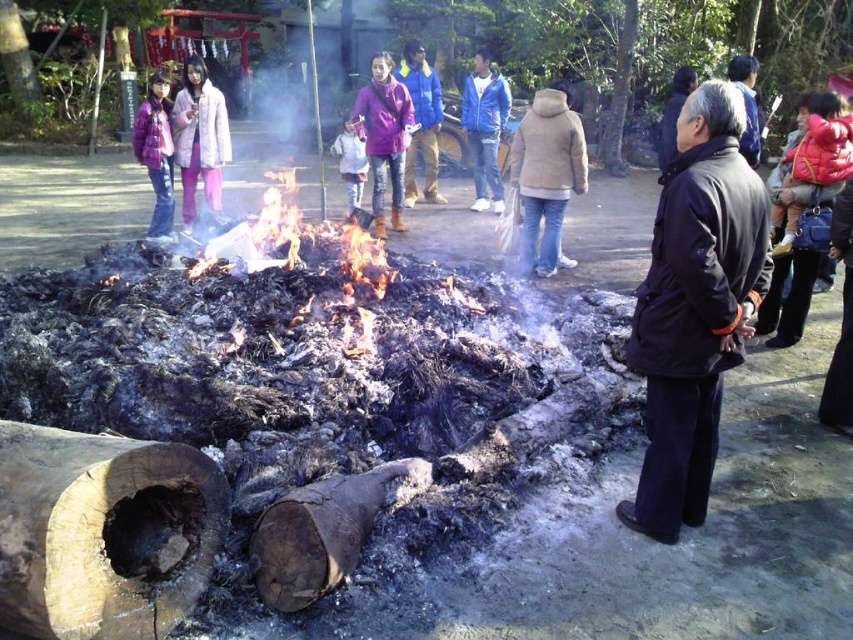
Can you confirm if pink fuzzy coat at center is wider than blue down jacket at center?

No, pink fuzzy coat at center is not wider than blue down jacket at center.

Is point (193, 109) closer to viewer compared to point (424, 163)?

Yes, point (193, 109) is in front of point (424, 163).

What are the coordinates of `pink fuzzy coat at center` in the screenshot? It's located at (199, 138).

Is point (662, 337) positioned behind point (782, 189)?

No, (662, 337) is closer to viewer.

In order to click on dark woolen coat at right in this screenshot , I will do `click(695, 307)`.

Describe the element at coordinates (102, 532) in the screenshot. I see `charred wood log at lower left` at that location.

Does charred wood log at lower left have a smaller size compared to blue down jacket at center?

Yes, charred wood log at lower left is smaller than blue down jacket at center.

Does point (103, 541) come in front of point (425, 141)?

Yes.

At what (x,y) coordinates should I click in order to perform the action: click on charred wood log at lower left. Please return your answer as a coordinate pair (x, y). Looking at the image, I should click on (102, 532).